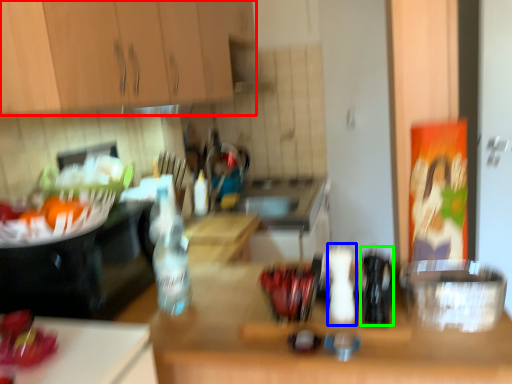
Question: Considering the real-world distances, which object is closest to cabinetry (highlighted by a red box)? bottle (highlighted by a blue box) or bottle (highlighted by a green box).

Choices:
 (A) bottle
 (B) bottle

Answer: (A)